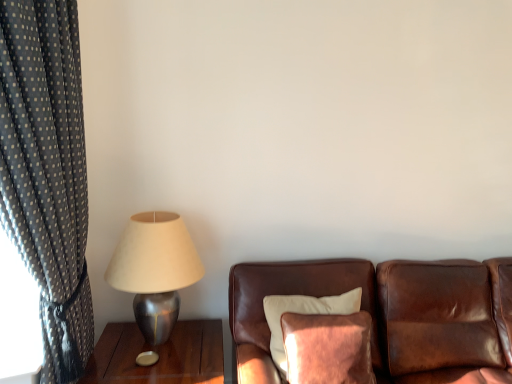
I want to click on vacant location below metallic silver lamp at left (from a real-world perspective), so click(x=168, y=344).